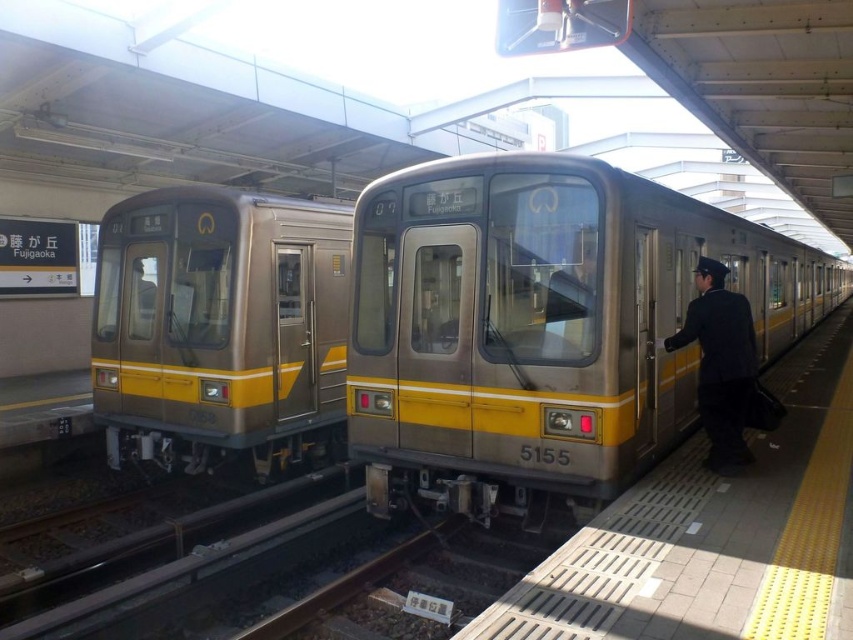
Based on the photo, does metallic silver train at center appear on the left side of metallic platform at center?

Correct, you'll find metallic silver train at center to the left of metallic platform at center.

Is point (515, 506) positioned in front of point (666, 595)?

No, (515, 506) is behind (666, 595).

Is point (723, 257) farther from viewer compared to point (547, 625)?

Yes, it is behind point (547, 625).

The image size is (853, 640). I want to click on metallic silver train at center, so click(543, 324).

Does metallic silver train at center come behind dark blue uniform at right?

No, metallic silver train at center is closer to the viewer.

Between metallic silver train at center and dark blue uniform at right, which one is positioned higher?

metallic silver train at center is higher up.

Does point (554, 160) lie in front of point (712, 422)?

Yes, point (554, 160) is closer to viewer.

Image resolution: width=853 pixels, height=640 pixels. What are the coordinates of `metallic silver train at center` in the screenshot? It's located at (543, 324).

Locate an element on the screen. This screenshot has width=853, height=640. metallic silver train at left is located at coordinates (219, 328).

Is point (160, 352) more distant than point (839, 552)?

Yes, it is behind point (839, 552).

You are a GUI agent. You are given a task and a screenshot of the screen. Output one action in this format:
    pyautogui.click(x=<x>, y=<y>)
    Task: Click on the metallic silver train at left
    This screenshot has width=853, height=640.
    Given the screenshot: What is the action you would take?
    pyautogui.click(x=219, y=328)